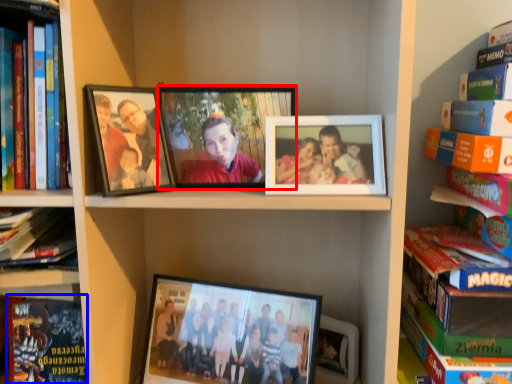
Question: Which of the following is the closest to the observer, picture frame (highlighted by a red box) or paperback book (highlighted by a blue box)?

Choices:
 (A) picture frame
 (B) paperback book

Answer: (A)